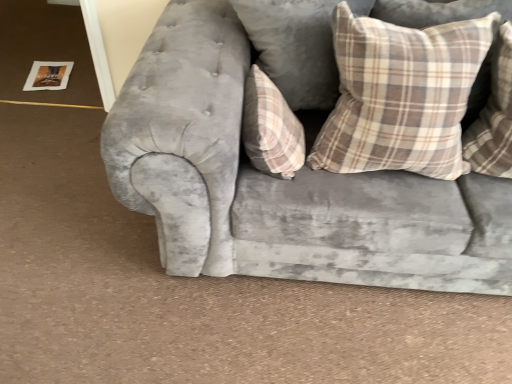
Question: Is velvet gray couch at center wider than plaid fabric pillow at upper right, which is the 3th pillow in left-to-right order?

Choices:
 (A) yes
 (B) no

Answer: (A)

Question: From the image's perspective, is velvet gray couch at center below plaid fabric pillow at upper right, which is the 3th pillow in left-to-right order?

Choices:
 (A) no
 (B) yes

Answer: (B)

Question: Can you confirm if velvet gray couch at center is shorter than plaid fabric pillow at upper right, which is the 3th pillow in left-to-right order?

Choices:
 (A) no
 (B) yes

Answer: (A)

Question: Can you confirm if velvet gray couch at center is positioned to the right of plaid fabric pillow at upper right, which ranks as the 1th pillow in right-to-left order?

Choices:
 (A) yes
 (B) no

Answer: (B)

Question: Is velvet gray couch at center facing towards plaid fabric pillow at upper right, which is the 3th pillow in left-to-right order?

Choices:
 (A) no
 (B) yes

Answer: (B)

Question: From the image's perspective, is plaid fabric pillow at center, the third pillow viewed from the right, positioned above or below velvet gray couch at center?

Choices:
 (A) above
 (B) below

Answer: (B)

Question: In terms of width, does plaid fabric pillow at center, the third pillow viewed from the right, look wider or thinner when compared to velvet gray couch at center?

Choices:
 (A) wide
 (B) thin

Answer: (B)

Question: Visually, is plaid fabric pillow at center, the third pillow viewed from the right, positioned to the left or to the right of velvet gray couch at center?

Choices:
 (A) right
 (B) left

Answer: (B)

Question: From a real-world perspective, relative to velvet gray couch at center, is plaid fabric pillow at center, which is counted as the first pillow, starting from the left, vertically above or below?

Choices:
 (A) below
 (B) above

Answer: (B)

Question: From a real-world perspective, is plaid fabric pillow at center, which is counted as the first pillow, starting from the left, above or below plaid fabric pillow at upper right, which ranks as the 1th pillow in right-to-left order?

Choices:
 (A) below
 (B) above

Answer: (A)

Question: Is point (259, 162) closer or farther from the camera than point (468, 152)?

Choices:
 (A) closer
 (B) farther

Answer: (A)

Question: Choose the correct answer: Is plaid fabric pillow at center, which is counted as the first pillow, starting from the left, inside plaid fabric pillow at upper right, which ranks as the 1th pillow in right-to-left order, or outside it?

Choices:
 (A) inside
 (B) outside

Answer: (B)

Question: In terms of width, does plaid fabric pillow at center, which is counted as the first pillow, starting from the left, look wider or thinner when compared to plaid fabric pillow at upper right, which is the 3th pillow in left-to-right order?

Choices:
 (A) wide
 (B) thin

Answer: (B)

Question: Is velvet gray couch at center wider or thinner than plaid fabric pillow at center, which is counted as the first pillow, starting from the left?

Choices:
 (A) thin
 (B) wide

Answer: (B)

Question: Does point (218, 145) appear closer or farther from the camera than point (280, 175)?

Choices:
 (A) farther
 (B) closer

Answer: (B)